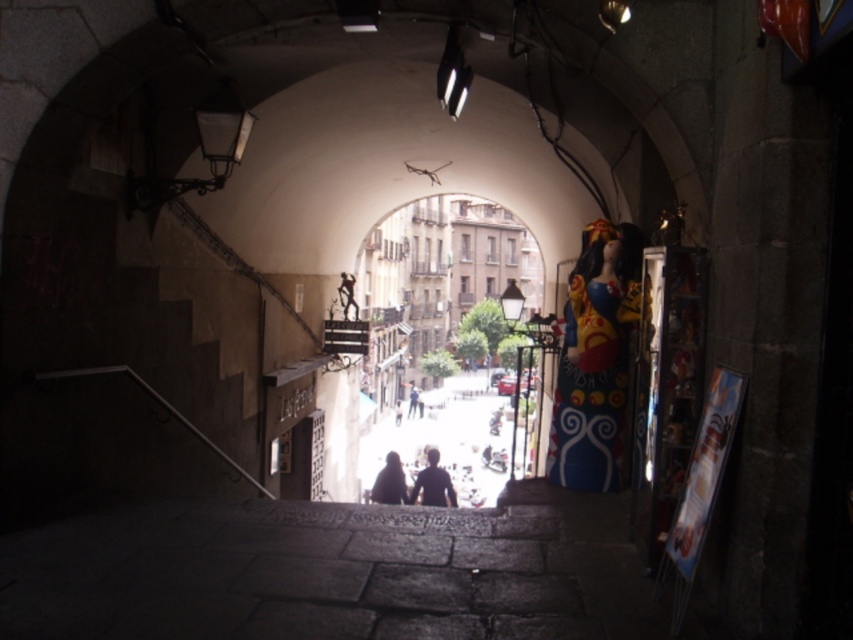
You are a tourist standing at the entrance of the stone archway. You see the matte black figures at center and the dark blue fabric at center in the scene. Which object is taller?

The matte black figures at center is much taller than the dark blue fabric at center.

You are standing at the entrance of the stone archway and see two figures in the center of the scene. The first is labeled as the matte black figures at center, and the second is the dark matte figure at center. Which of these two figures is closer to you?

The matte black figures at center is 35.93 feet away from the dark matte figure at center. Since the question asks which is closer to you, we need to determine their positions relative to the viewer. However, the given distance between them doesn not provide direct information about their distance from the viewer. Without additional data on their individual distances from the entrance, it is impossible to determine which is closer based solely on the provided information.

You are a tourist standing in front of the stone archway and see the matte black figures at center and the dark blue fabric at center. Which object is located to the right side of the other?

The matte black figures at center is positioned on the right side of dark blue fabric at center.